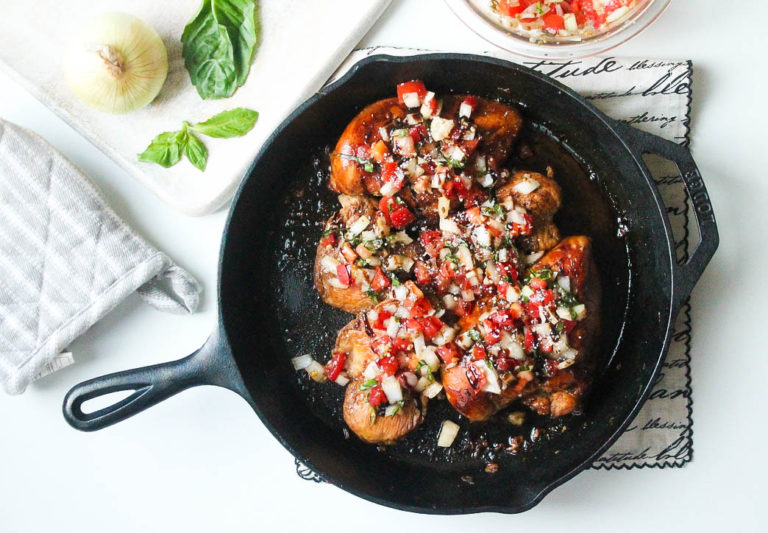
Locate an element on the screen. handle is located at coordinates (161, 383).